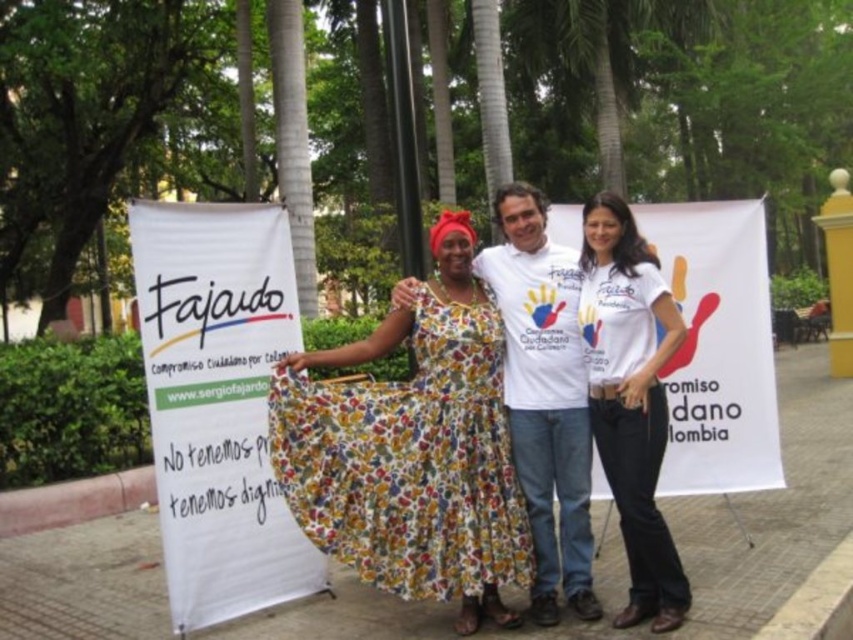
You are a photographer trying to capture both the white fabric banner at left and the white fabric banner at center in a single shot. Since both banners are white, you want to ensure they are distinguishable in your photo. Which banner should you focus on first to ensure it appears clearer in the frame?

The white fabric banner at left is positioned on the left side of white fabric banner at center. Since it is closer to the left edge of the frame, focusing on it first will help ensure it remains clear while capturing both banners in the shot.